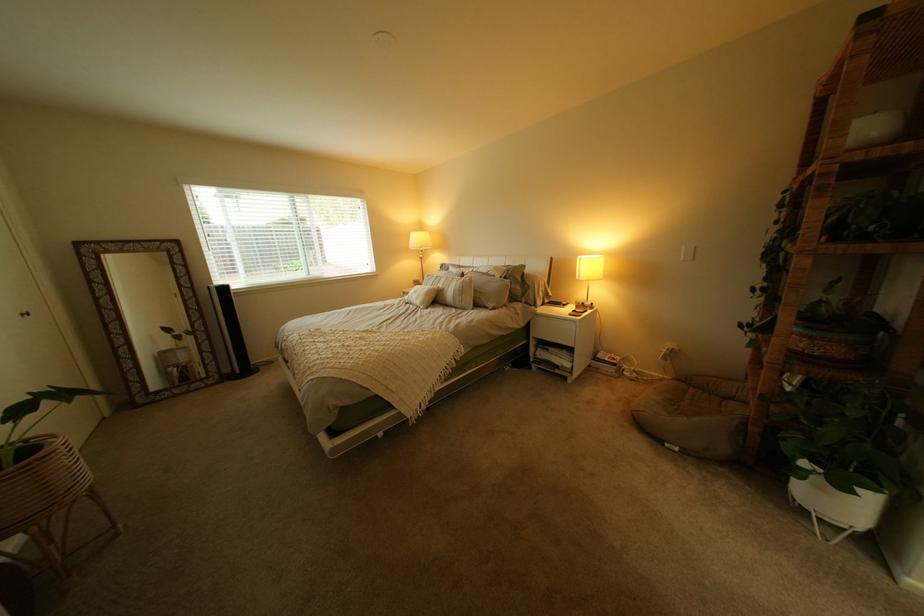
The height and width of the screenshot is (616, 924). What do you see at coordinates (580, 309) in the screenshot? I see `a smartphone` at bounding box center [580, 309].